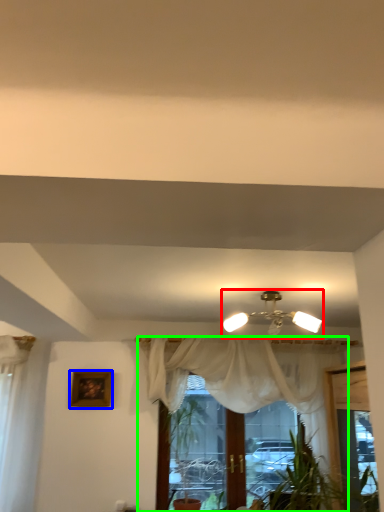
Question: Considering the real-world distances, which object is closest to lamp (highlighted by a red box)? picture frame (highlighted by a blue box) or curtain (highlighted by a green box).

Choices:
 (A) picture frame
 (B) curtain

Answer: (B)